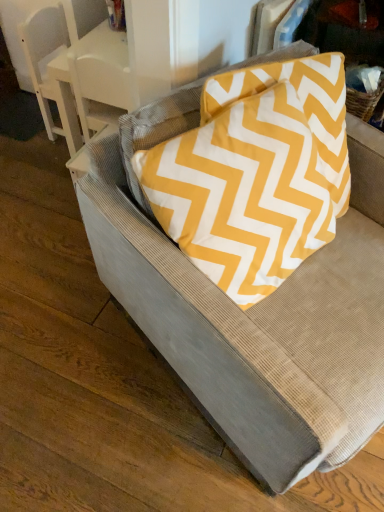
Measure the distance between point (152, 32) and camera.

Point (152, 32) and camera are 38.66 inches apart from each other.

At what (x,y) coordinates should I click in order to perform the action: click on white glossy table at upper left. Please return your answer as a coordinate pair (x, y). Looking at the image, I should click on (115, 63).

Is textured gray cushion at center oriented towards yellow zigzag fabric pillow at upper right?

No, textured gray cushion at center is not aimed at yellow zigzag fabric pillow at upper right.

Can you confirm if textured gray cushion at center is taller than yellow zigzag fabric pillow at upper right?

Yes.

Does point (108, 169) lie in front of point (243, 72)?

No.

Where is `chair that is on the right side of yellow zigzag fabric pillow at upper right`? This screenshot has width=384, height=512. chair that is on the right side of yellow zigzag fabric pillow at upper right is located at coordinates (258, 321).

Is the depth of textured gray armchair at upper left greater than that of white glossy table at upper left?

Yes, it is.

From the image's perspective, is textured gray armchair at upper left over white glossy table at upper left?

Yes, from the image's perspective, textured gray armchair at upper left is above white glossy table at upper left.

The image size is (384, 512). Find the location of `table that appears below the textured gray armchair at upper left (from the image's perspective)`. table that appears below the textured gray armchair at upper left (from the image's perspective) is located at coordinates (115, 63).

Between textured gray cushion at center and textured gray armchair at upper left, which one appears on the left side from the viewer's perspective?

Positioned to the left is textured gray armchair at upper left.

This screenshot has height=512, width=384. Find the location of `armchair that is behind the textured gray cushion at center`. armchair that is behind the textured gray cushion at center is located at coordinates (48, 73).

Based on the photo, can you confirm if textured gray cushion at center is wider than textured gray armchair at upper left?

Correct, the width of textured gray cushion at center exceeds that of textured gray armchair at upper left.

Looking at the image, does textured gray cushion at center seem bigger or smaller compared to textured gray armchair at upper left?

In the image, textured gray cushion at center appears to be larger than textured gray armchair at upper left.

From the picture: Does textured gray cushion at center have a larger size compared to white glossy table at upper left?

Yes.

Between textured gray cushion at center and white glossy table at upper left, which one appears on the right side from the viewer's perspective?

textured gray cushion at center is more to the right.

From a real-world perspective, is textured gray cushion at center physically below white glossy table at upper left?

Actually, textured gray cushion at center is physically above white glossy table at upper left in the real world.

From the image's perspective, who appears lower, textured gray cushion at center or white glossy table at upper left?

textured gray cushion at center appears lower in the image.

Does yellow zigzag fabric pillow at upper right touch white glossy table at upper left?

No.

Can you confirm if yellow zigzag fabric pillow at upper right is wider than white glossy table at upper left?

Incorrect, the width of yellow zigzag fabric pillow at upper right does not surpass that of white glossy table at upper left.

From the picture: Would you say yellow zigzag fabric pillow at upper right is inside or outside white glossy table at upper left?

yellow zigzag fabric pillow at upper right is located beyond the bounds of white glossy table at upper left.

Considering their positions, is yellow zigzag fabric pillow at upper right located in front of or behind white glossy table at upper left?

yellow zigzag fabric pillow at upper right is positioned closer to the viewer than white glossy table at upper left.

Is white glossy table at upper left outside of textured gray cushion at center?

Absolutely, white glossy table at upper left is external to textured gray cushion at center.

Is white glossy table at upper left facing away from textured gray cushion at center?

No.

Between white glossy table at upper left and textured gray cushion at center, which one has larger size?

textured gray cushion at center is bigger.

From a real-world perspective, is white glossy table at upper left physically below textured gray cushion at center?

Yes, from a real-world perspective, white glossy table at upper left is under textured gray cushion at center.

Is yellow zigzag fabric pillow at upper right aimed at textured gray armchair at upper left?

No, yellow zigzag fabric pillow at upper right is not aimed at textured gray armchair at upper left.

Considering the positions of points (320, 165) and (48, 38), is point (320, 165) farther from camera compared to point (48, 38)?

That is False.

Which object is thinner, yellow zigzag fabric pillow at upper right or textured gray armchair at upper left?

yellow zigzag fabric pillow at upper right is thinner.

From the image's perspective, which one is positioned higher, yellow zigzag fabric pillow at upper right or textured gray armchair at upper left?

textured gray armchair at upper left appears higher in the image.

Locate an element on the screen. This screenshot has height=512, width=384. pillow on the left side of textured gray cushion at center is located at coordinates (302, 105).

The height and width of the screenshot is (512, 384). Identify the location of table lying in front of the textured gray armchair at upper left. (115, 63).

Looking at the image, which one is located further to yellow zigzag fabric pillow at upper right, white glossy table at upper left or textured gray cushion at center?

white glossy table at upper left is further to yellow zigzag fabric pillow at upper right.

From the image, which object appears to be nearer to yellow zigzag fabric pillow at upper right, textured gray armchair at upper left or white glossy table at upper left?

Based on the image, white glossy table at upper left appears to be nearer to yellow zigzag fabric pillow at upper right.

When comparing their distances from white glossy table at upper left, does textured gray armchair at upper left or textured gray cushion at center seem closer?

Based on the image, textured gray armchair at upper left appears to be nearer to white glossy table at upper left.

In the scene shown: Based on their spatial positions, is textured gray armchair at upper left or white glossy table at upper left further from textured gray cushion at center?

textured gray armchair at upper left is further to textured gray cushion at center.

When comparing their distances from textured gray armchair at upper left, does white glossy table at upper left or yellow zigzag fabric pillow at upper right seem closer?

white glossy table at upper left.

Considering their positions, is textured gray cushion at center positioned further to white glossy table at upper left than yellow zigzag fabric pillow at upper right?

Based on the image, textured gray cushion at center appears to be further to white glossy table at upper left.

When comparing their distances from textured gray armchair at upper left, does textured gray cushion at center or white glossy table at upper left seem further?

Among the two, textured gray cushion at center is located further to textured gray armchair at upper left.

Estimate the real-world distances between objects in this image. Which object is further from yellow zigzag fabric pillow at upper right, textured gray armchair at upper left or textured gray cushion at center?

textured gray armchair at upper left lies further to yellow zigzag fabric pillow at upper right than the other object.

Where is `pillow between textured gray cushion at center and textured gray armchair at upper left in the front-back direction`? pillow between textured gray cushion at center and textured gray armchair at upper left in the front-back direction is located at coordinates (302, 105).

At what (x,y) coordinates should I click in order to perform the action: click on table positioned between yellow zigzag fabric pillow at upper right and textured gray armchair at upper left from near to far. Please return your answer as a coordinate pair (x, y). This screenshot has height=512, width=384. Looking at the image, I should click on (115, 63).

The image size is (384, 512). Identify the location of pillow located between textured gray cushion at center and white glossy table at upper left in the depth direction. (302, 105).

This screenshot has width=384, height=512. What are the coordinates of `table between textured gray cushion at center and textured gray armchair at upper left in the front-back direction` in the screenshot? It's located at (115, 63).